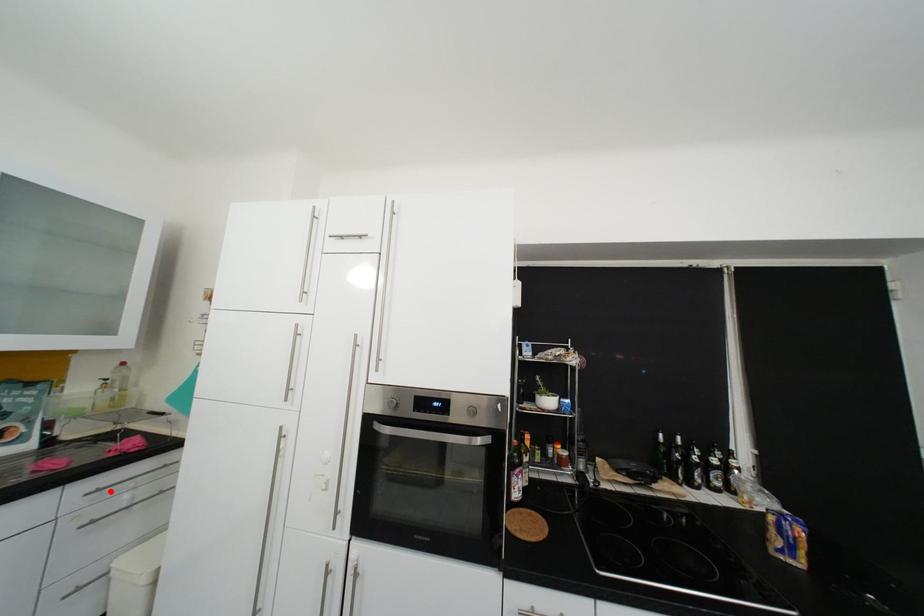
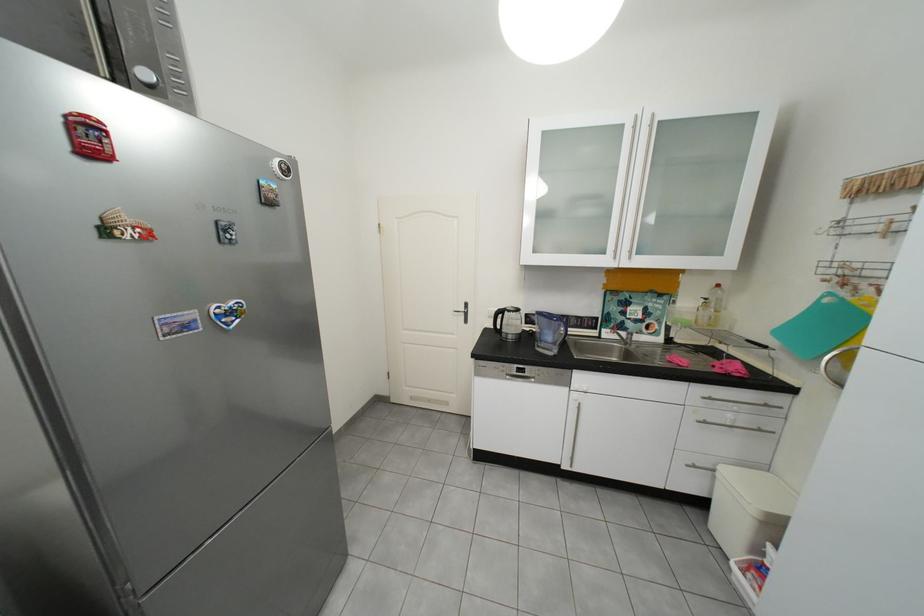
Locate, in the second image, the point that corresponds to the highlighted location in the first image.

(723, 400)